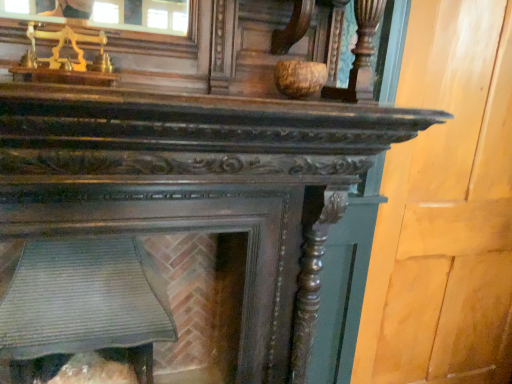
Image resolution: width=512 pixels, height=384 pixels. What do you see at coordinates (200, 305) in the screenshot? I see `metallic gray grate at lower left` at bounding box center [200, 305].

At what (x,y) coordinates should I click in order to perform the action: click on metallic gray grate at lower left. Please return your answer as a coordinate pair (x, y). Image resolution: width=512 pixels, height=384 pixels. Looking at the image, I should click on (200, 305).

Where is `metallic gray grate at lower left`? This screenshot has height=384, width=512. metallic gray grate at lower left is located at coordinates (200, 305).